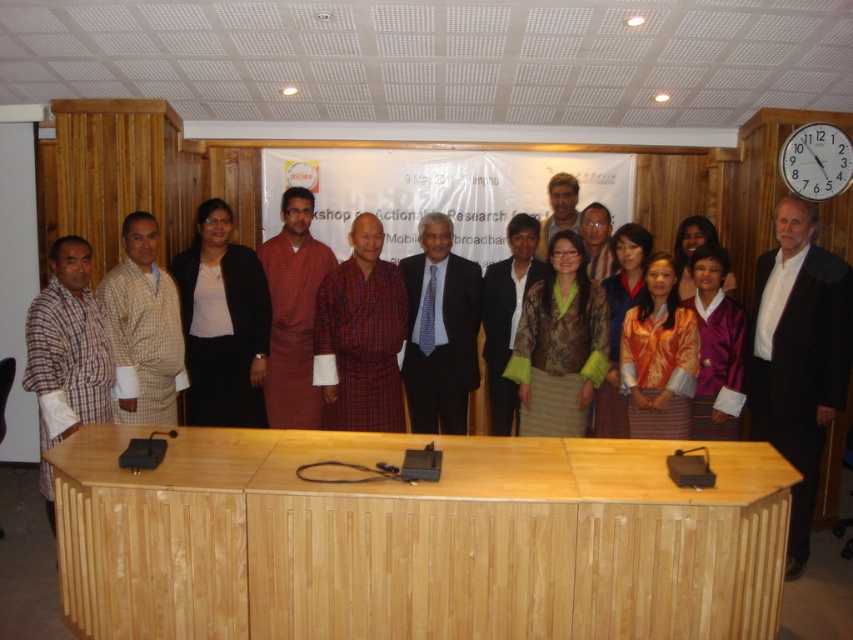
Question: Considering the relative positions of plaid fabric shirt at center and checkered fabric shirt at left in the image provided, where is plaid fabric shirt at center located with respect to checkered fabric shirt at left?

Choices:
 (A) right
 (B) left

Answer: (A)

Question: Does green textured jacket at center have a greater width compared to plaid fabric shirt at left?

Choices:
 (A) yes
 (B) no

Answer: (A)

Question: Among these objects, which one is nearest to the camera?

Choices:
 (A) plaid fabric shirt at center
 (B) orange silk blouse at center

Answer: (B)

Question: Is matte black blazer at center to the right of white plastic clock at upper right from the viewer's perspective?

Choices:
 (A) no
 (B) yes

Answer: (A)

Question: Which point is farther from the camera taking this photo?

Choices:
 (A) (724, 259)
 (B) (419, 284)
 (C) (721, 284)

Answer: (B)

Question: Which point is farther to the camera?

Choices:
 (A) orange silk blouse at center
 (B) black wool suit at right

Answer: (A)